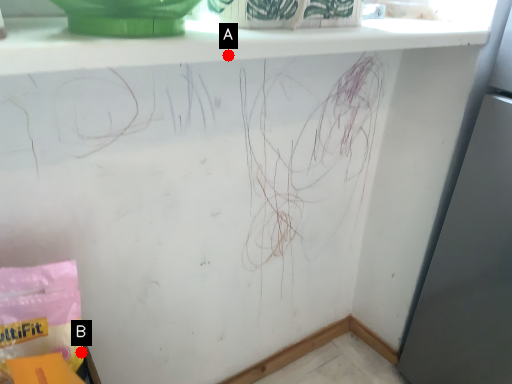
Question: Two points are circled on the image, labeled by A and B beside each circle. Among these points, which one is farthest from the camera?

Choices:
 (A) A is further
 (B) B is further

Answer: (B)